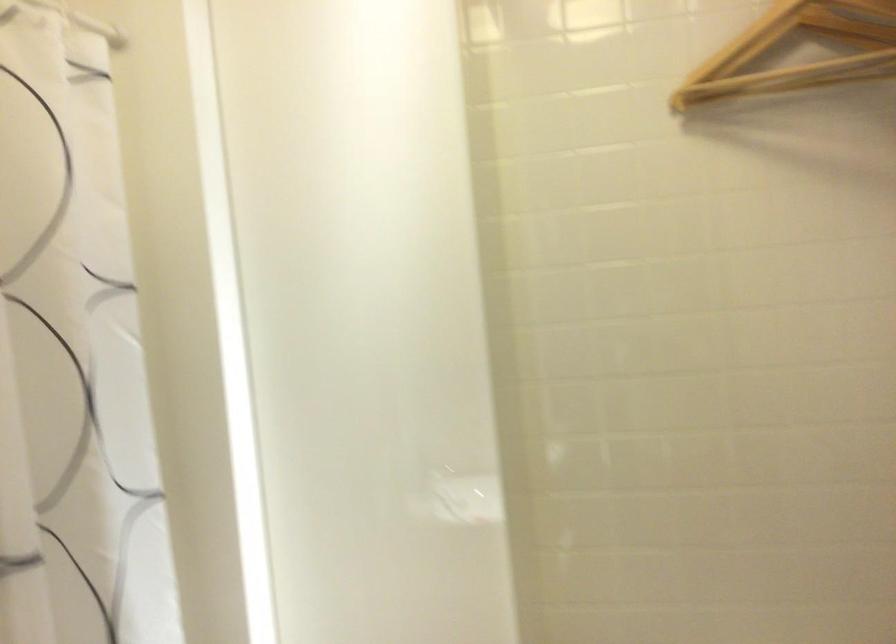
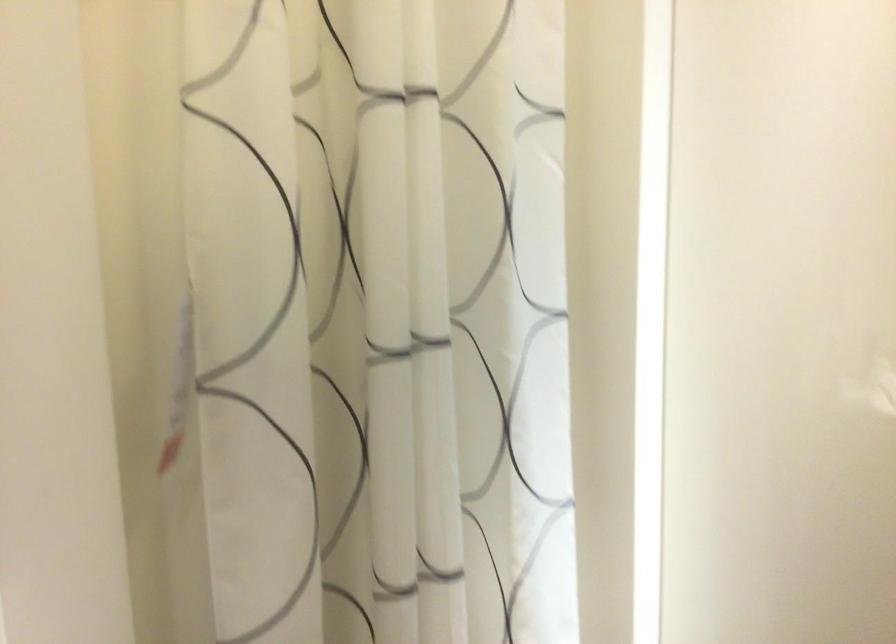
Question: The camera is either moving clockwise (left) or counter-clockwise (right) around the object. The first image is from the beginning of the video and the second image is from the end. Is the camera moving left or right when shooting the video?

Choices:
 (A) Left
 (B) Right

Answer: (B)